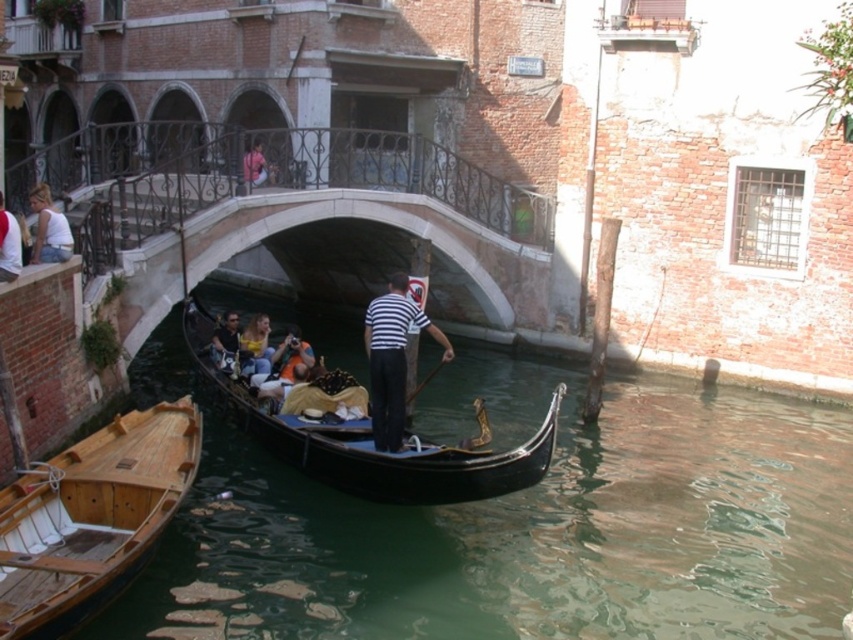
Is greenish water at center positioned at the back of white cotton shirt at upper left?

No, greenish water at center is in front of white cotton shirt at upper left.

Does point (688, 464) come closer to viewer compared to point (38, 192)?

No, (688, 464) is further to viewer.

Locate an element on the screen. This screenshot has width=853, height=640. greenish water at center is located at coordinates (514, 522).

Is striped cotton shirt at center above white cotton shirt at upper left?

No, striped cotton shirt at center is not above white cotton shirt at upper left.

Which of these two, striped cotton shirt at center or white cotton shirt at upper left, stands shorter?

Standing shorter between the two is white cotton shirt at upper left.

The image size is (853, 640). What are the coordinates of `striped cotton shirt at center` in the screenshot? It's located at (x=392, y=358).

Which is below, wooden boat at lower left or shiny black gondola at center?

wooden boat at lower left is below.

Who is more distant from viewer, [143,464] or [485,451]?

Point [485,451]

At what (x,y) coordinates should I click in order to perform the action: click on wooden boat at lower left. Please return your answer as a coordinate pair (x, y). This screenshot has width=853, height=640. Looking at the image, I should click on (91, 516).